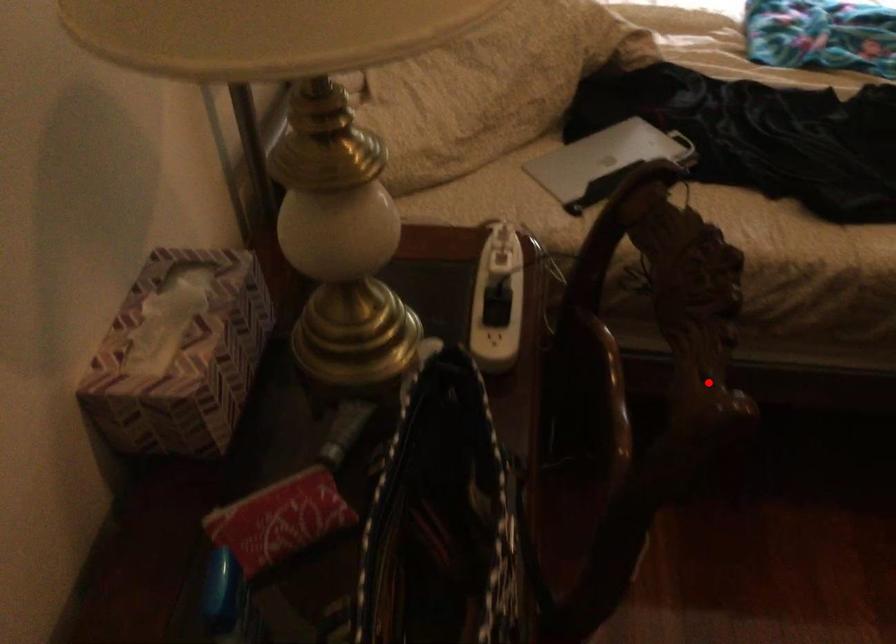
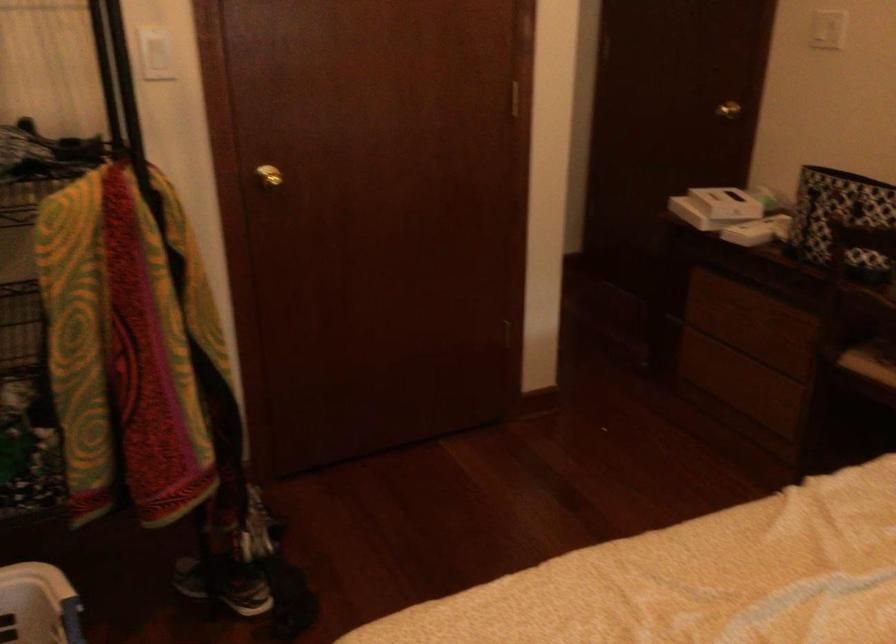
Find the pixel in the second image that matches the highlighted location in the first image.

(840, 218)